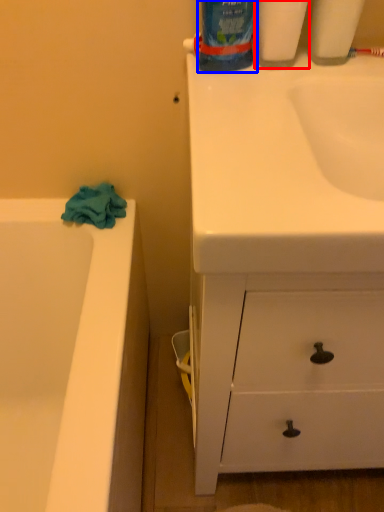
Question: Which point is further to the camera, cleaning product (highlighted by a red box) or cleaning product (highlighted by a blue box)?

Choices:
 (A) cleaning product
 (B) cleaning product

Answer: (A)